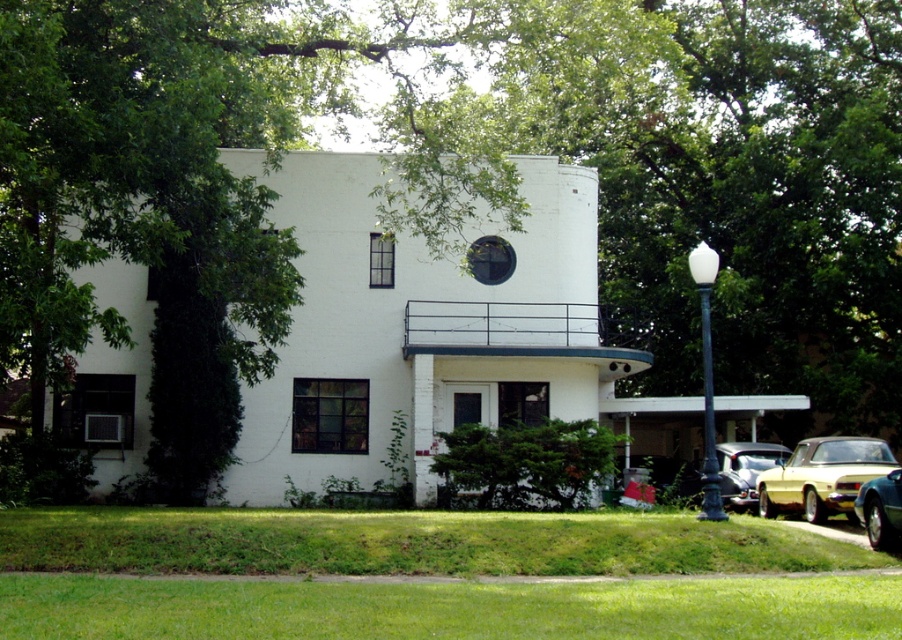
You are a delivery driver approaching the entrance of the two story white building. You have a shiny silver car at lower right and a metallic gold car at lower right parked nearby. Can you fit both cars into the parking space next to the entrance if the space is only 5 meters long?

The shiny silver car at lower right is shorter than the metallic gold car at lower right. However, without knowing the exact lengths of both cars, it is impossible to determine if they can fit into a 5 meter space together.

You are a delivery person standing at the entrance of the two story white building with a modern architectural design. You need to park your delivery van between the shiny silver car at lower right and the metallic gold car at lower right. The van is 25 feet long. Is there enough space between the two cars to park the van?

The distance between the shiny silver car at lower right and metallic gold car at lower right is 33.00 feet. Since the van is 25 feet long, there is sufficient space to park the van between them.

From the picture: You are standing at the entrance of the two story white building and want to plant a new tree exactly where the green leafy tree at center is currently located. What are the coordinates of the point where you should plant the new tree?

The coordinates for the green leafy tree at center are at point (272, 152), so you should plant the new tree at those coordinates.